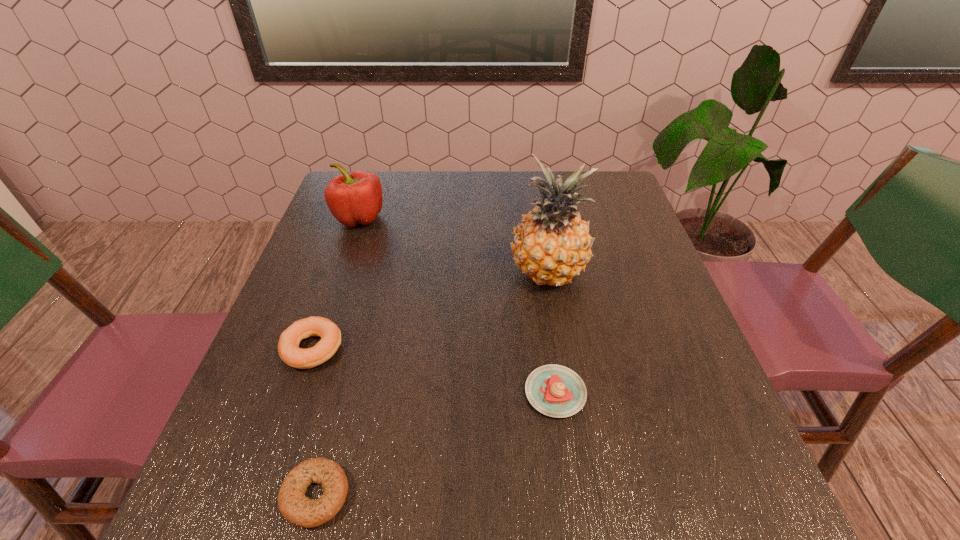
I want to click on free space in the image that satisfies the following two spatial constraints: 1. on the back side of the third tallest object; 2. on the right side of the pineapple, so click(x=338, y=275).

At what (x,y) coordinates should I click in order to perform the action: click on free point that satisfies the following two spatial constraints: 1. on the back side of the third shortest object; 2. on the right side of the bell pepper. Please return your answer as a coordinate pair (x, y). Looking at the image, I should click on (358, 218).

At what (x,y) coordinates should I click in order to perform the action: click on vacant space that satisfies the following two spatial constraints: 1. on the front side of the nearer bagel; 2. on the right side of the bell pepper. Please return your answer as a coordinate pair (x, y). The image size is (960, 540). Looking at the image, I should click on (265, 495).

Image resolution: width=960 pixels, height=540 pixels. In order to click on free space that satisfies the following two spatial constraints: 1. on the back side of the tallest object; 2. on the right side of the farther bagel in this screenshot , I will do `click(338, 275)`.